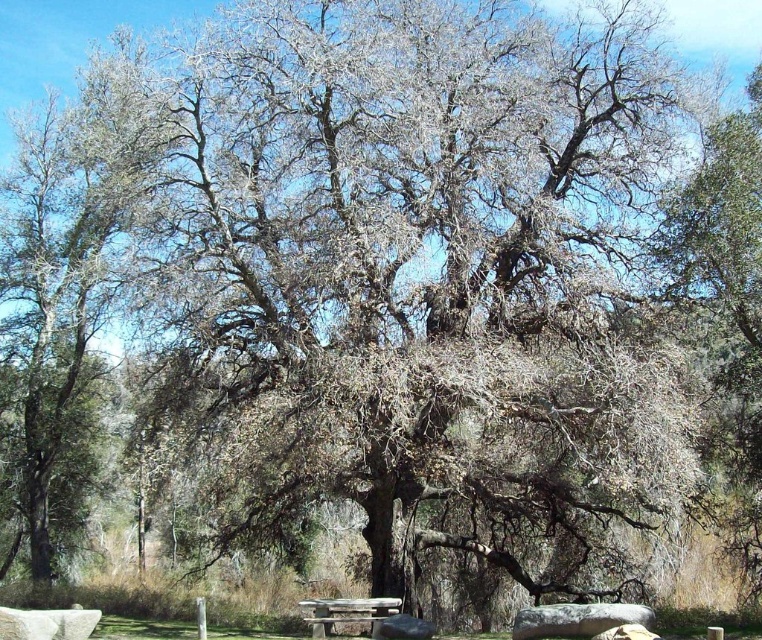
You are standing at the picnic table under the oak tree and want to walk to a specific point. Which of the two points, point (149, 141) or point (376, 625), is closer to you?

Point (149, 141) is in front of point (376, 625), so it is closer to you.